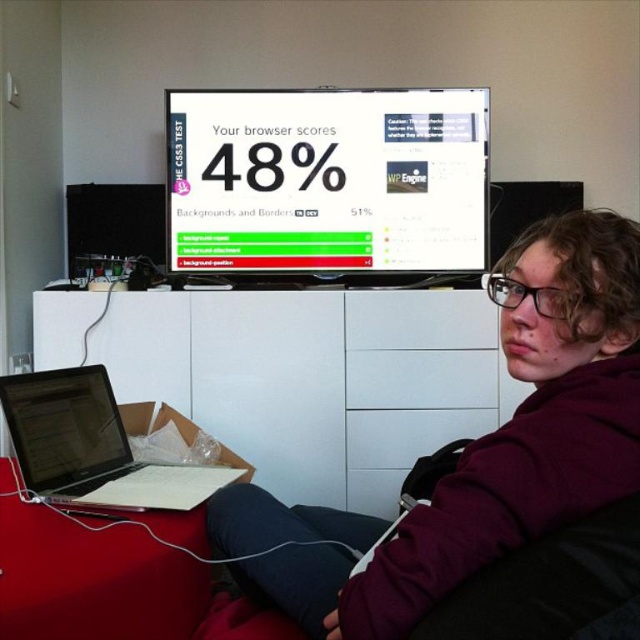
You are a technician trying to fix a connectivity issue between two laptops and a TV. You see the matte black laptop at lower left and the silver metallic laptop at lower left. Which laptop is closer to the TV?

The matte black laptop at lower left is below the silver metallic laptop at lower left, so the silver metallic laptop at lower left is closer to the TV since it is positioned above the matte black one.